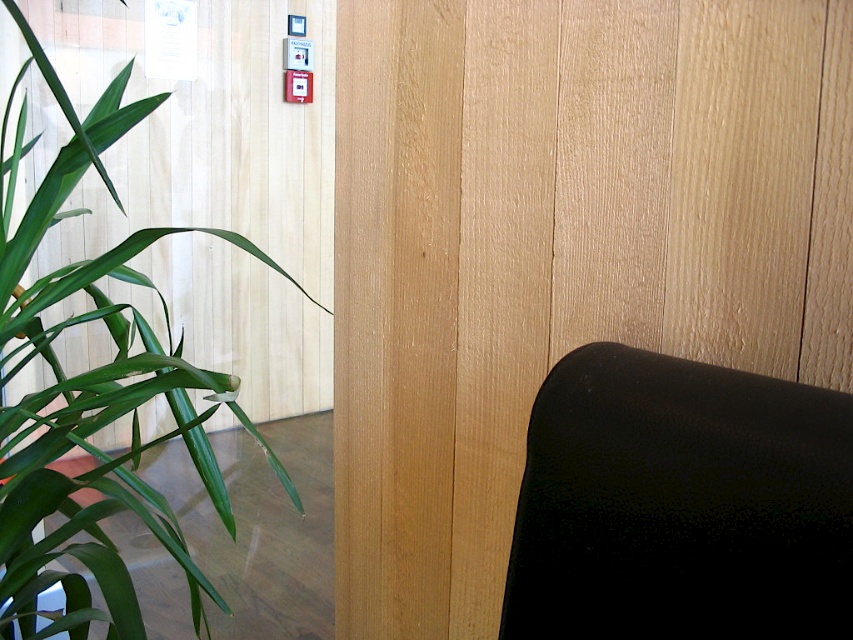
Question: Where is black matte chair at right located in relation to green leafy plant at left in the image?

Choices:
 (A) below
 (B) above

Answer: (B)

Question: Can you confirm if black matte chair at right is bigger than green leafy plant at left?

Choices:
 (A) yes
 (B) no

Answer: (B)

Question: Which point is closer to the camera?

Choices:
 (A) black matte chair at right
 (B) green leafy plant at left

Answer: (A)

Question: Is black matte chair at right to the right of green leafy plant at left from the viewer's perspective?

Choices:
 (A) yes
 (B) no

Answer: (A)